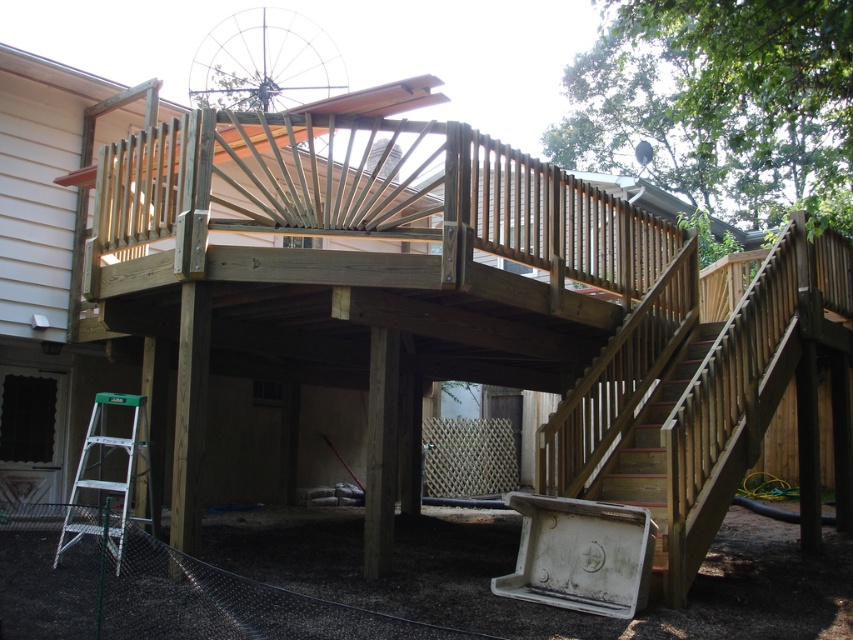
Based on the photo, which of these two, silver/aluminum step ladder at lower left or wooden stairs at lower right, stands taller?

With more height is wooden stairs at lower right.

Which is in front, point (134, 476) or point (674, 381)?

Positioned in front is point (134, 476).

Find the location of `silver/aluminum step ladder at lower left`. silver/aluminum step ladder at lower left is located at coordinates (109, 472).